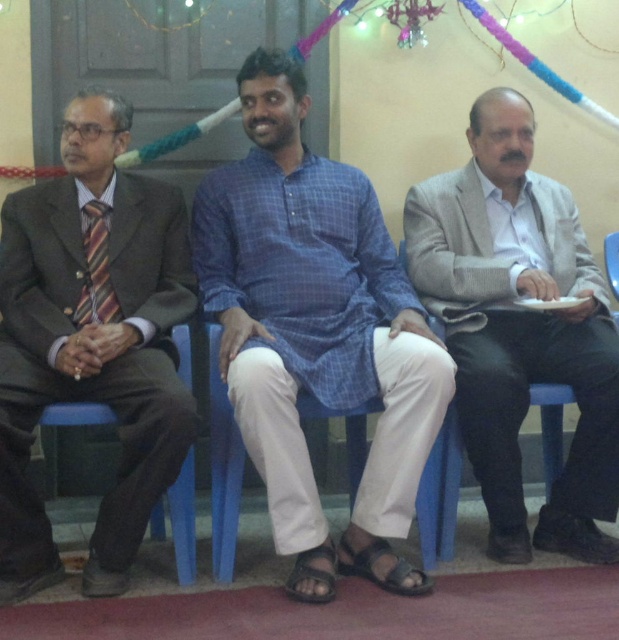
What do you see at coordinates (92, 340) in the screenshot?
I see `matte brown suit at left` at bounding box center [92, 340].

At what (x,y) coordinates should I click in order to perform the action: click on matte brown suit at left. Please return your answer as a coordinate pair (x, y). The image size is (619, 640). Looking at the image, I should click on (92, 340).

Who is positioned more to the left, matte brown suit at left or blue plastic chair at center?

matte brown suit at left

Identify the location of matte brown suit at left. Image resolution: width=619 pixels, height=640 pixels. (92, 340).

Where is `matte brown suit at left`? This screenshot has width=619, height=640. matte brown suit at left is located at coordinates (92, 340).

Which of these two, blue checkered kurta at center or gray woolen suit at right, stands taller?

Standing taller between the two is blue checkered kurta at center.

Locate an element on the screen. blue checkered kurta at center is located at coordinates (316, 332).